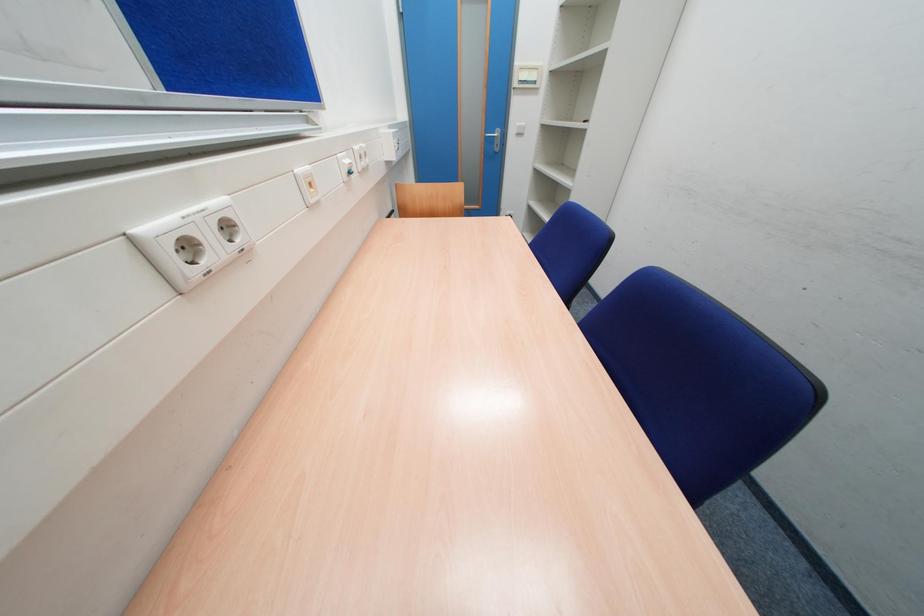
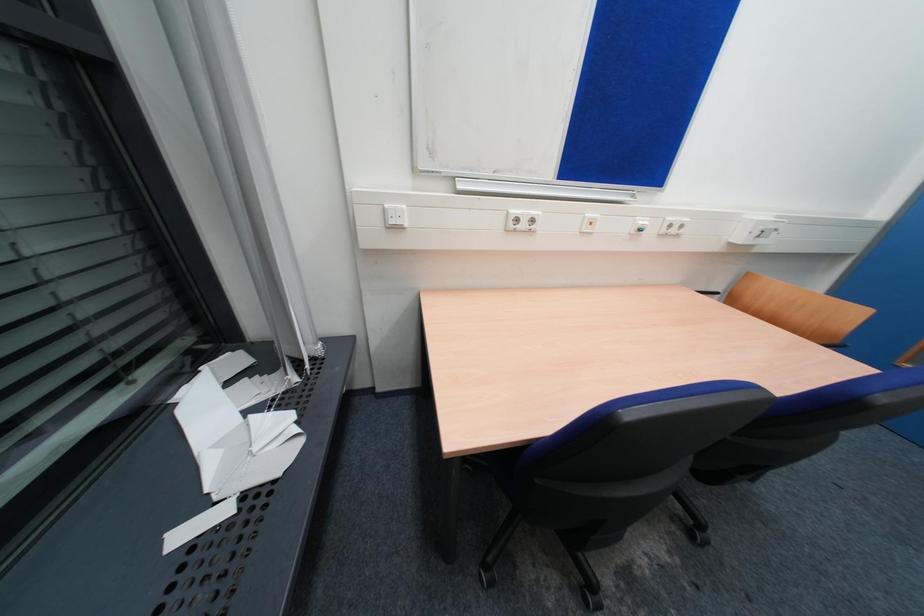
First-person continuous shooting, in which direction is the camera rotating?

The camera rotated toward left-down.